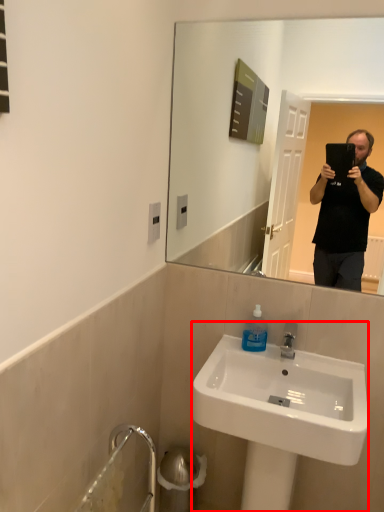
Question: From the image's perspective, considering the relative positions of sink (annotated by the red box) and bottle in the image provided, where is sink (annotated by the red box) located with respect to the staircase?

Choices:
 (A) below
 (B) above

Answer: (A)